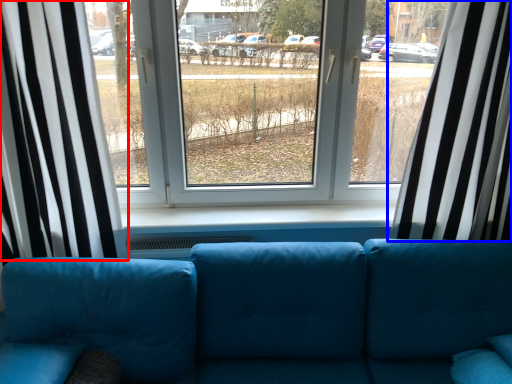
Question: Among these objects, which one is farthest to the camera, curtain (highlighted by a red box) or curtain (highlighted by a blue box)?

Choices:
 (A) curtain
 (B) curtain

Answer: (B)